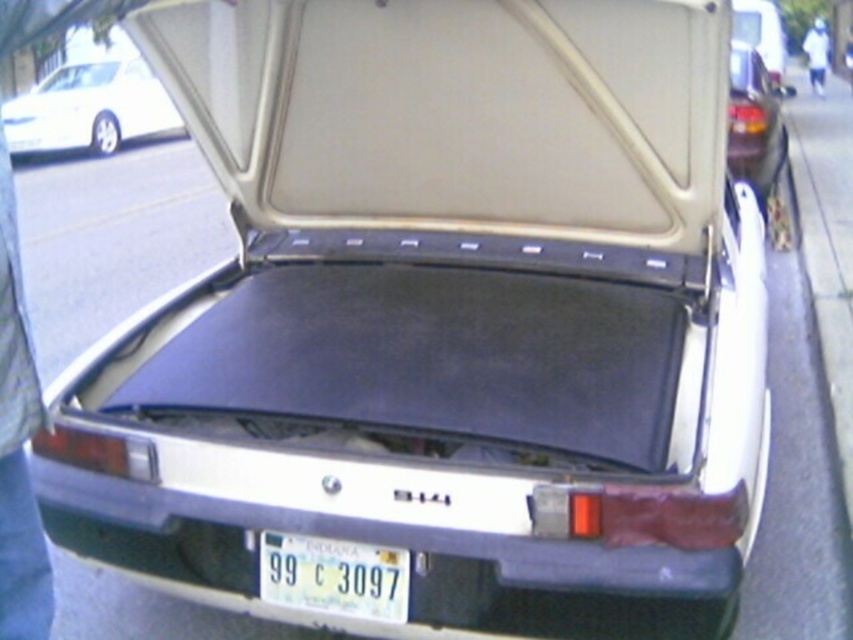
You are standing at the center of the image and want to approach the white matte car at upper left. According to the coordinates provided, in which general direction should you move to reach it?

The white matte car at upper left is located at point coordinates that are to the upper left of the center, so you should move toward the upper left direction to reach it.

You are a delivery person trying to load a package into the trunk of the white matte car at upper left. The package requires a minimum height clearance of 1.5 meters. Can the package fit inside the black matte trunk at upper right based on the height?

The white matte car at upper left is much taller than the black matte trunk at upper right, so the trunk is not tall enough to accommodate the package requiring 1.5 meters of height clearance.

You are a delivery person trying to deliver a package to the trunk of the white matte car at upper left. However, the trunk is open, and you notice the white plastic license plate at lower center. Can you place the package inside the trunk without moving the license plate?

The white plastic license plate at lower center is behind the white matte car at upper left, so placing the package inside the trunk would not interfere with the license plate as it is positioned behind the car.